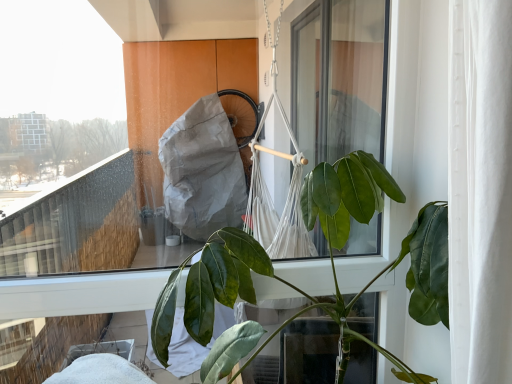
Question: Visually, is transparent glass window at center positioned to the left or to the right of green glossy leafy plant at center?

Choices:
 (A) right
 (B) left

Answer: (B)

Question: From a real-world perspective, is transparent glass window at center physically located above or below green glossy leafy plant at center?

Choices:
 (A) above
 (B) below

Answer: (A)

Question: Is transparent glass window at center taller or shorter than green glossy leafy plant at center?

Choices:
 (A) short
 (B) tall

Answer: (B)

Question: From a real-world perspective, relative to transparent glass window at center, is green glossy leafy plant at center vertically above or below?

Choices:
 (A) above
 (B) below

Answer: (B)

Question: In terms of height, does green glossy leafy plant at center look taller or shorter compared to transparent glass window at center?

Choices:
 (A) short
 (B) tall

Answer: (A)

Question: Is green glossy leafy plant at center in front of or behind transparent glass window at center in the image?

Choices:
 (A) front
 (B) behind

Answer: (A)

Question: In the image, is green glossy leafy plant at center on the left side or the right side of transparent glass window at center?

Choices:
 (A) right
 (B) left

Answer: (A)